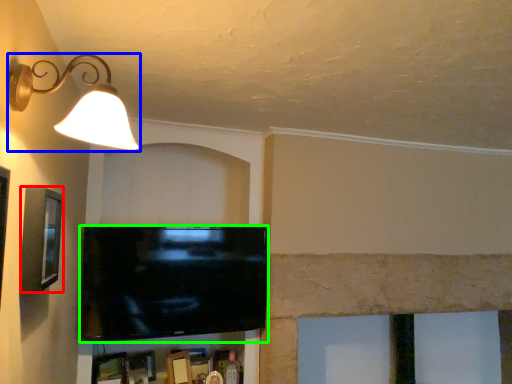
Question: Considering the real-world distances, which object is farthest from picture frame (highlighted by a red box)? lamp (highlighted by a blue box) or television (highlighted by a green box)?

Choices:
 (A) lamp
 (B) television

Answer: (B)